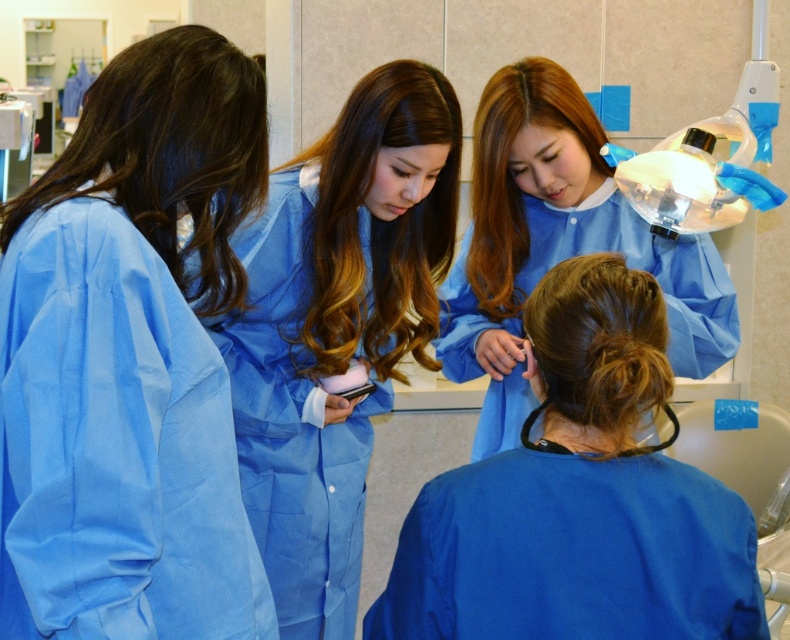
You are a medical student standing in the center of the room. You notice two points marked in the scene, one at coordinates point (x=134, y=81) and another at point (x=533, y=90). Which point is nearer to your current position?

Point (x=134, y=81) is closer to the camera than point (x=533, y=90), so the point at coordinates point (x=134, y=81) is nearer to your current position.

You are a medical student observing the scene. You notice two people wearing blue smooth scrubs at left and blue smooth scrubs at center. Which person is shorter?

The blue smooth scrubs at left is not as tall as blue smooth scrubs at center, so the person wearing blue smooth scrubs at left is shorter.

From the picture: You are a medical student observing the scene. You notice the blue smooth scrubs at center and the smooth brown hair at upper left. Which object is higher in the image?

The blue smooth scrubs at center is taller than smooth brown hair at upper left.